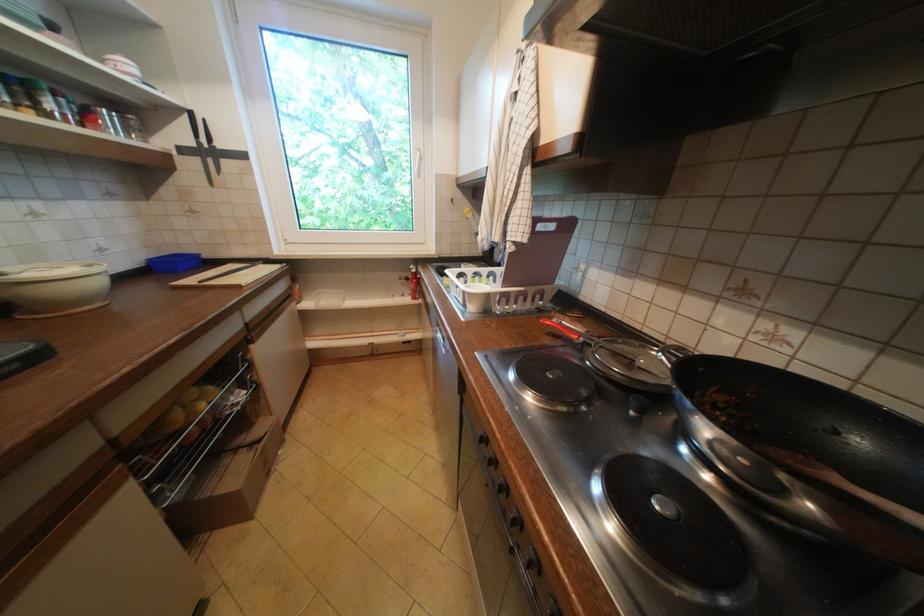
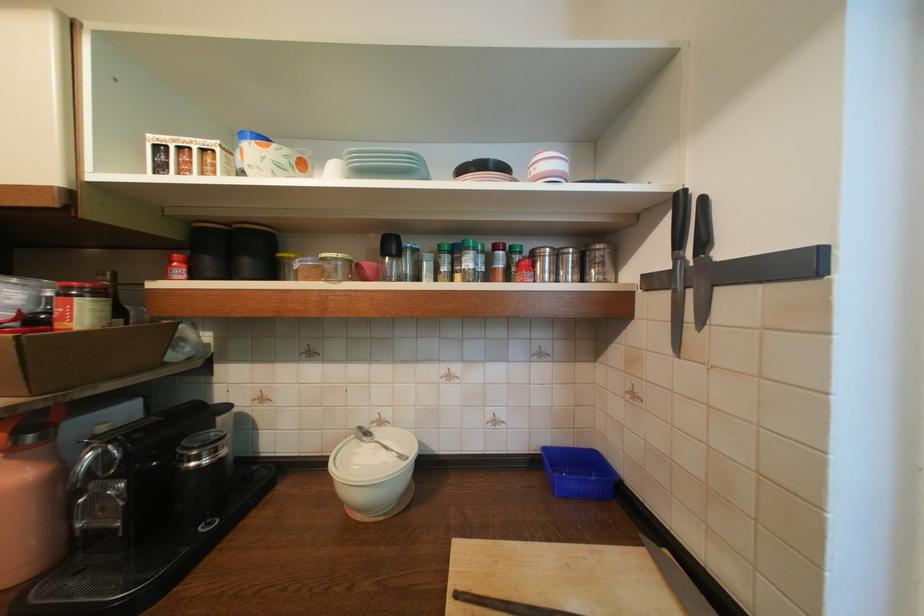
Where in the second image is the point corresponding to point (200, 114) from the first image?

(687, 199)